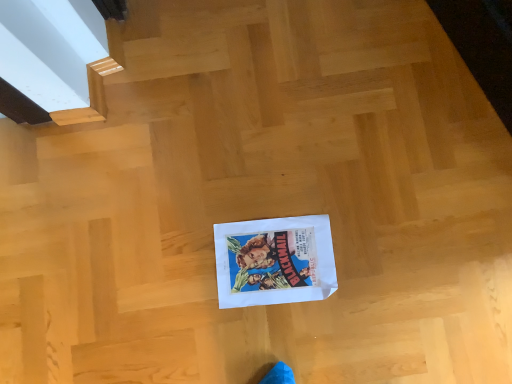
Identify the location of vacant area on top of white paper flyer at center (from a real-world perspective). This screenshot has width=512, height=384. (276, 265).